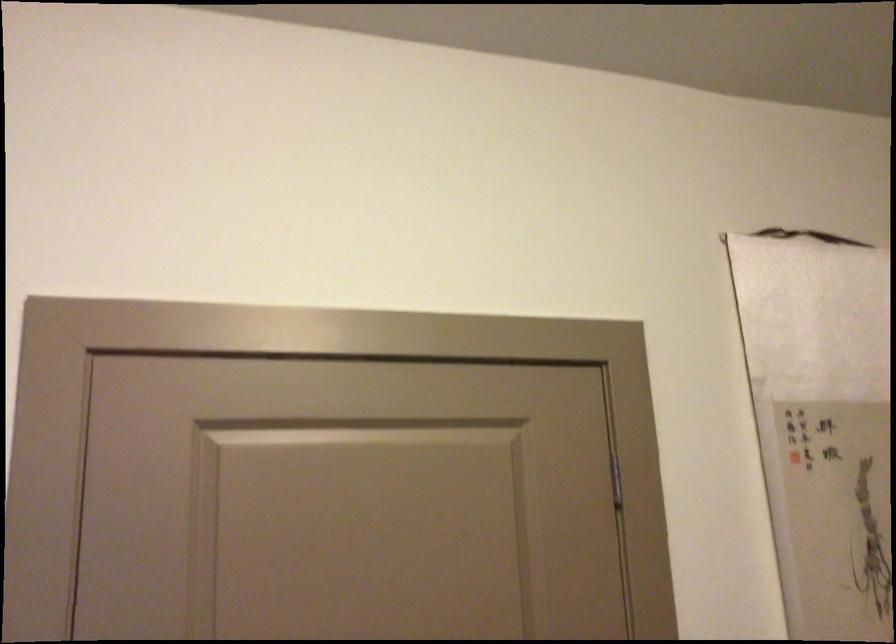
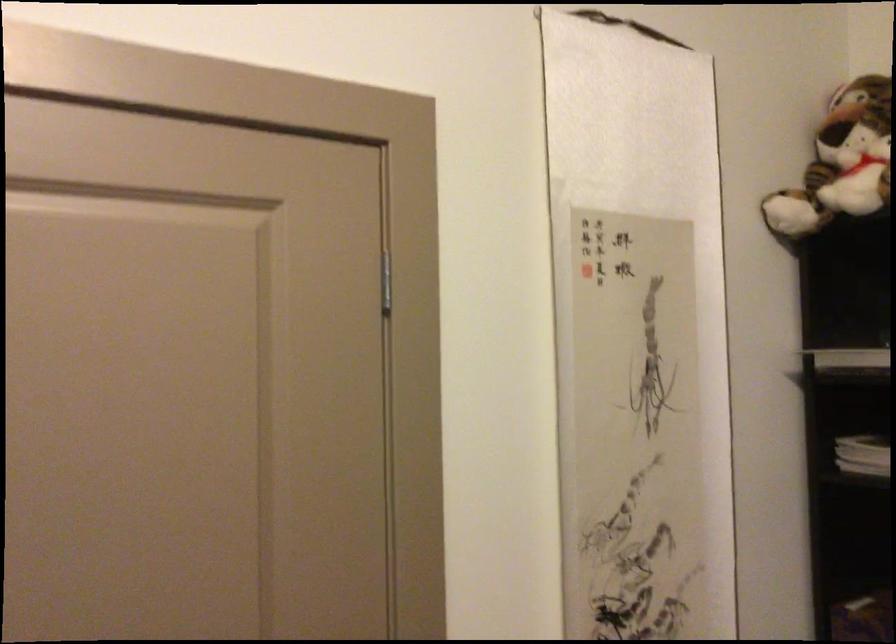
Which direction would the cameraman need to move to produce the second image?

The cameraman walked toward right, forward.